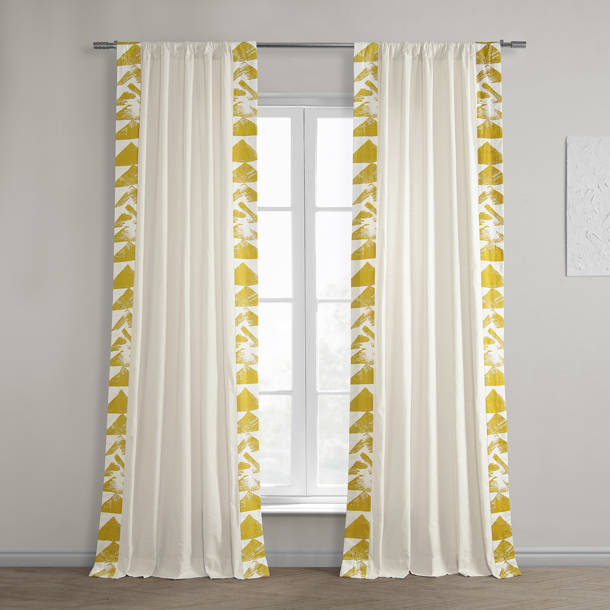
Image resolution: width=610 pixels, height=610 pixels. I want to click on baseboard, so click(x=551, y=556), click(x=299, y=559), click(x=30, y=558).